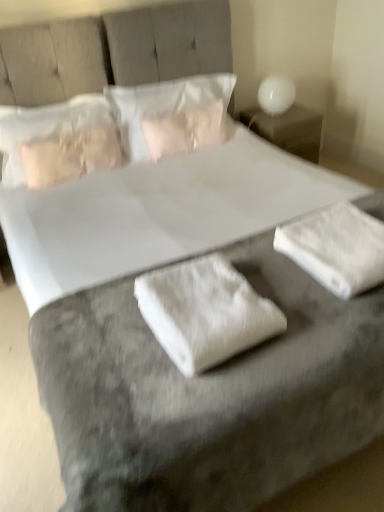
This screenshot has width=384, height=512. I want to click on vacant space in front of white glossy table lamp at upper right, so click(x=284, y=120).